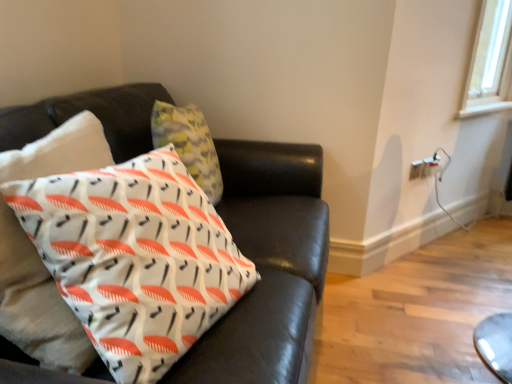
Image resolution: width=512 pixels, height=384 pixels. What are the coordinates of `white fabric pillow at left` in the screenshot? It's located at (135, 257).

What do you see at coordinates (135, 257) in the screenshot? I see `white fabric pillow at left` at bounding box center [135, 257].

Find the location of a particular element. white fabric pillow at left is located at coordinates coord(135,257).